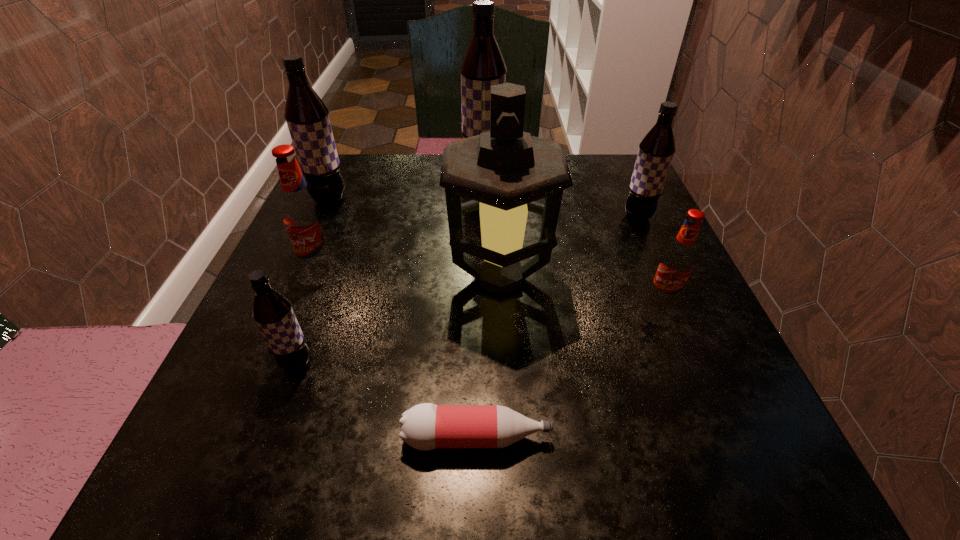
The image size is (960, 540). I want to click on the second brown root beer from right to left, so click(x=483, y=66).

Locate an element on the screen. The height and width of the screenshot is (540, 960). the farthest brown root beer is located at coordinates (483, 66).

The width and height of the screenshot is (960, 540). Find the location of `oil lamp`. oil lamp is located at coordinates (503, 171).

You are a GUI agent. You are given a task and a screenshot of the screen. Output one action in this format:
    pyautogui.click(x=<x>, y=<y>)
    Task: Click on the second biggest brown root beer
    
    Given the screenshot: What is the action you would take?
    pyautogui.click(x=307, y=117)

This screenshot has width=960, height=540. I want to click on the bigger red root beer, so click(303, 216).

I want to click on the left red root beer, so click(x=303, y=216).

The height and width of the screenshot is (540, 960). I want to click on the third biggest brown root beer, so click(656, 150).

I want to click on the second nearest root beer, so click(678, 260).

The height and width of the screenshot is (540, 960). In order to click on the right red root beer in this screenshot , I will do coord(678,260).

You are a GUI agent. You are given a task and a screenshot of the screen. Output one action in this format:
    pyautogui.click(x=<x>, y=<y>)
    Task: Click on the nearest brown root beer
    Image resolution: width=960 pixels, height=540 pixels.
    Given the screenshot: What is the action you would take?
    pyautogui.click(x=272, y=311)